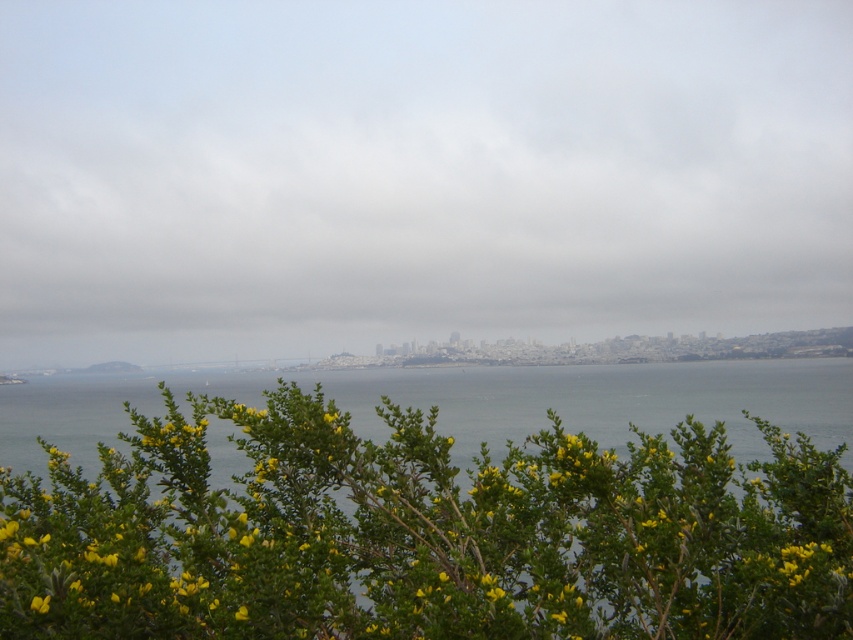
Question: Is transparent water at center below green leafy bush at lower center?

Choices:
 (A) yes
 (B) no

Answer: (B)

Question: From the image, what is the correct spatial relationship of transparent water at center in relation to green leafy bush at lower center?

Choices:
 (A) above
 (B) below

Answer: (A)

Question: Does transparent water at center have a smaller size compared to green leafy bush at lower center?

Choices:
 (A) no
 (B) yes

Answer: (A)